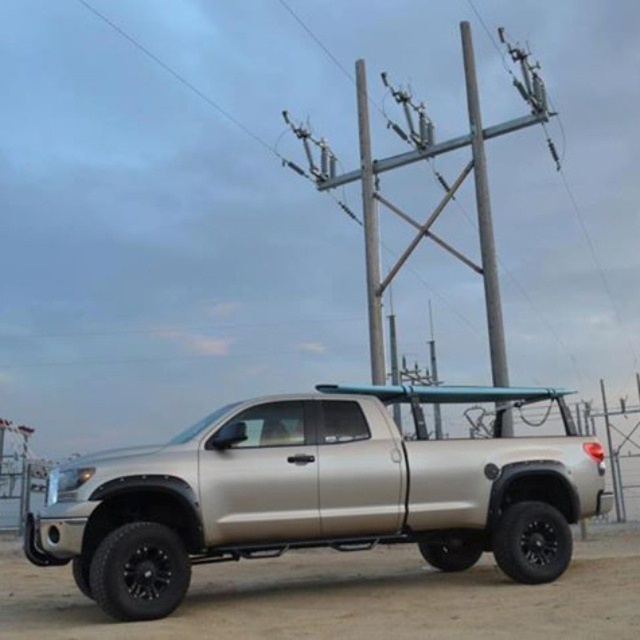
Is satin silver truck at center taller than gray metallic telegraph pole at upper center?

In fact, satin silver truck at center may be shorter than gray metallic telegraph pole at upper center.

Can you confirm if satin silver truck at center is positioned to the right of gray metallic telegraph pole at upper center?

In fact, satin silver truck at center is to the left of gray metallic telegraph pole at upper center.

This screenshot has width=640, height=640. In order to click on satin silver truck at center in this screenshot , I will do `click(316, 493)`.

This screenshot has height=640, width=640. Find the location of `satin silver truck at center`. satin silver truck at center is located at coordinates (316, 493).

Who is more distant from viewer, [390,422] or [205,628]?

Point [390,422]

Does point (282, 540) come farther from viewer compared to point (262, 580)?

That is False.

Is point (417, 412) less distant than point (236, 621)?

No, (417, 412) is behind (236, 621).

I want to click on satin silver truck at center, so click(x=316, y=493).

Can you confirm if brown dirt at lower center is positioned above gray metallic telegraph pole at upper center?

Actually, brown dirt at lower center is below gray metallic telegraph pole at upper center.

Is point (392, 554) closer to camera compared to point (467, 22)?

Yes, point (392, 554) is closer to viewer.

Who is more distant from viewer, (x=225, y=577) or (x=506, y=417)?

The point (x=506, y=417) is more distant.

The width and height of the screenshot is (640, 640). Find the location of `brown dirt at lower center`. brown dirt at lower center is located at coordinates 349,600.